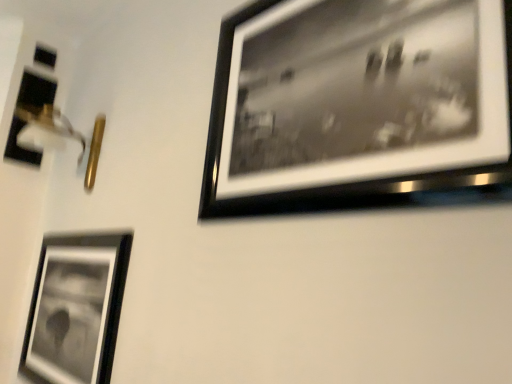
Question: Can you confirm if black matte picture frame at upper right, arranged as the 3th picture frame when viewed from the left, is shorter than matte black picture frame at left, arranged as the 1th picture frame when viewed from the left?

Choices:
 (A) no
 (B) yes

Answer: (A)

Question: Is black matte picture frame at upper right, which ranks as the first picture frame in front-to-back order, taller than matte black picture frame at left, positioned as the third picture frame in front-to-back order?

Choices:
 (A) no
 (B) yes

Answer: (B)

Question: From the image's perspective, would you say black matte picture frame at upper right, which ranks as the first picture frame in front-to-back order, is positioned over matte black picture frame at left, positioned as the third picture frame in front-to-back order?

Choices:
 (A) yes
 (B) no

Answer: (B)

Question: Is matte black picture frame at left, arranged as the 1th picture frame when viewed from the left, at the back of black matte picture frame at upper right, the 1th picture frame viewed from the right?

Choices:
 (A) no
 (B) yes

Answer: (A)

Question: Is black matte picture frame at upper right, the 1th picture frame viewed from the right, positioned far away from matte black picture frame at left, arranged as the first picture frame when viewed from the back?

Choices:
 (A) yes
 (B) no

Answer: (A)

Question: From the image's perspective, is matte black picture frame at left, arranged as the first picture frame when viewed from the back, positioned above or below black matte picture frame at upper right, the 1th picture frame viewed from the right?

Choices:
 (A) above
 (B) below

Answer: (A)

Question: Based on their positions, is matte black picture frame at left, positioned as the third picture frame in front-to-back order, located to the left or right of black matte picture frame at upper right, arranged as the 3th picture frame when viewed from the left?

Choices:
 (A) left
 (B) right

Answer: (A)

Question: Does point (37, 81) appear closer or farther from the camera than point (420, 162)?

Choices:
 (A) farther
 (B) closer

Answer: (A)

Question: From a real-world perspective, is matte black picture frame at left, arranged as the 1th picture frame when viewed from the left, physically located above or below black matte picture frame at upper right, which ranks as the first picture frame in front-to-back order?

Choices:
 (A) above
 (B) below

Answer: (A)

Question: From their relative heights in the image, would you say black matte picture frame at upper right, which ranks as the first picture frame in front-to-back order, is taller or shorter than metallic silver frame at lower left, marked as the second picture frame in a back-to-front arrangement?

Choices:
 (A) short
 (B) tall

Answer: (B)

Question: From the image's perspective, is black matte picture frame at upper right, arranged as the 3th picture frame when viewed from the left, positioned above or below metallic silver frame at lower left, placed as the second picture frame when sorted from left to right?

Choices:
 (A) below
 (B) above

Answer: (B)

Question: From a real-world perspective, is black matte picture frame at upper right, which ranks as the third picture frame in back-to-front order, above or below metallic silver frame at lower left, positioned as the second picture frame in right-to-left order?

Choices:
 (A) below
 (B) above

Answer: (B)

Question: Considering the relative positions of black matte picture frame at upper right, arranged as the 3th picture frame when viewed from the left, and metallic silver frame at lower left, positioned as the second picture frame in right-to-left order, in the image provided, is black matte picture frame at upper right, arranged as the 3th picture frame when viewed from the left, to the left or to the right of metallic silver frame at lower left, positioned as the second picture frame in right-to-left order,?

Choices:
 (A) right
 (B) left

Answer: (A)

Question: Considering the relative positions of metallic silver frame at lower left, marked as the second picture frame in a back-to-front arrangement, and matte black picture frame at left, arranged as the 1th picture frame when viewed from the left, in the image provided, is metallic silver frame at lower left, marked as the second picture frame in a back-to-front arrangement, to the left or to the right of matte black picture frame at left, arranged as the 1th picture frame when viewed from the left,?

Choices:
 (A) left
 (B) right

Answer: (B)

Question: Considering the positions of metallic silver frame at lower left, marked as the second picture frame in a back-to-front arrangement, and matte black picture frame at left, arranged as the first picture frame when viewed from the back, in the image, is metallic silver frame at lower left, marked as the second picture frame in a back-to-front arrangement, taller or shorter than matte black picture frame at left, arranged as the first picture frame when viewed from the back,?

Choices:
 (A) tall
 (B) short

Answer: (A)